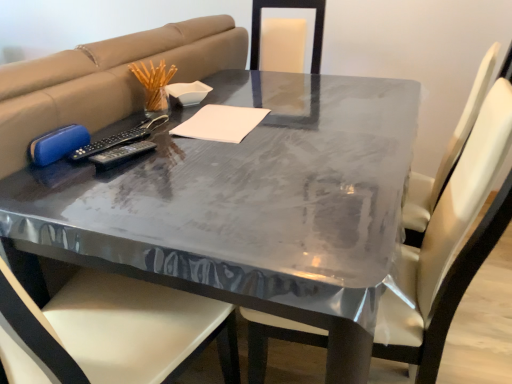
The image size is (512, 384). In order to click on vacant area that is in front of black plastic remote at center in this screenshot , I will do `click(109, 192)`.